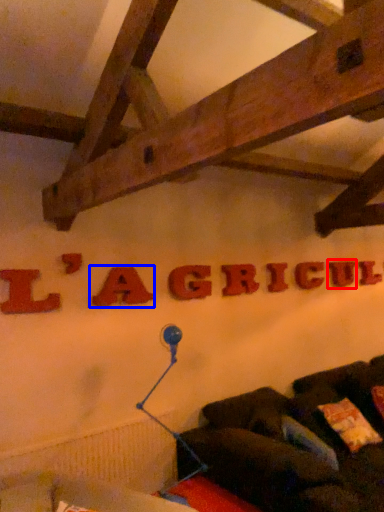
Question: Which object appears farthest to the camera in this image, letter (highlighted by a red box) or letter (highlighted by a blue box)?

Choices:
 (A) letter
 (B) letter

Answer: (A)